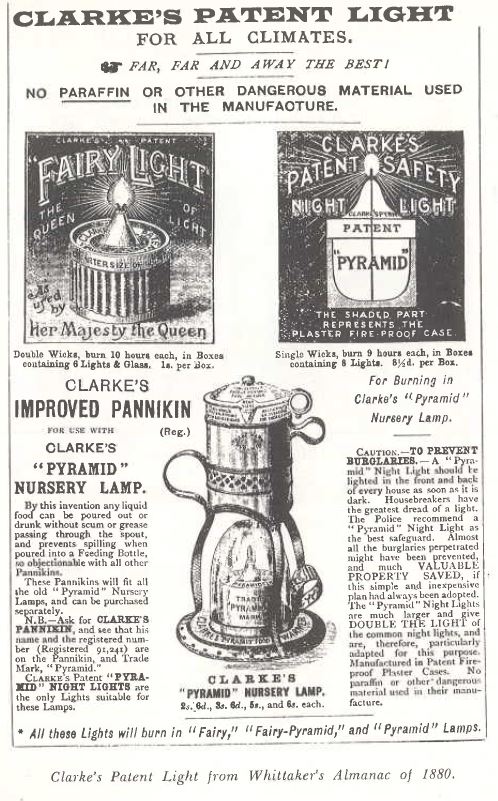
Locate an element on the screen. This screenshot has width=498, height=801. fire proof case is for safety is located at coordinates (358, 335), (398, 331), (438, 331).